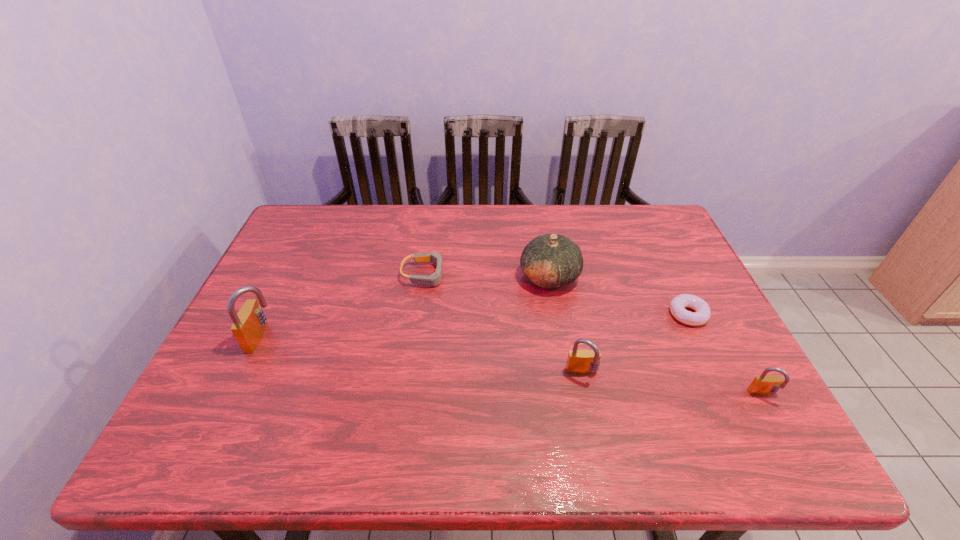
Where is `vacant area at the far left corner of the desktop`? This screenshot has height=540, width=960. vacant area at the far left corner of the desktop is located at coordinates (332, 231).

Where is `free point between the leftmost padlock and the fifth object from right to left`? The height and width of the screenshot is (540, 960). free point between the leftmost padlock and the fifth object from right to left is located at coordinates (344, 306).

This screenshot has height=540, width=960. I want to click on vacant area that lies between the third shortest object and the doughnut, so (x=726, y=355).

What are the coordinates of `free space between the nearest padlock and the gourd` in the screenshot? It's located at (656, 336).

Where is `free space between the second padlock from right to left and the fifth object from right to left`? The image size is (960, 540). free space between the second padlock from right to left and the fifth object from right to left is located at coordinates (504, 325).

This screenshot has width=960, height=540. I want to click on vacant space in between the nearest padlock and the goggles, so click(x=594, y=335).

Locate an element on the screen. unoccupied position between the doughnut and the gourd is located at coordinates (618, 295).

At what (x,y) coordinates should I click in order to perform the action: click on vacant area that lies between the second padlock from right to left and the nearest object. Please return your answer as a coordinate pair (x, y). Looking at the image, I should click on (673, 385).

Where is `free space between the goggles and the doughnut`? The width and height of the screenshot is (960, 540). free space between the goggles and the doughnut is located at coordinates (557, 294).

You are a GUI agent. You are given a task and a screenshot of the screen. Output one action in this format:
    pyautogui.click(x=<x>, y=<y>)
    Task: Click on the vacant point located between the farthest padlock and the second object from left to right
    The height and width of the screenshot is (540, 960).
    Given the screenshot: What is the action you would take?
    pyautogui.click(x=344, y=306)